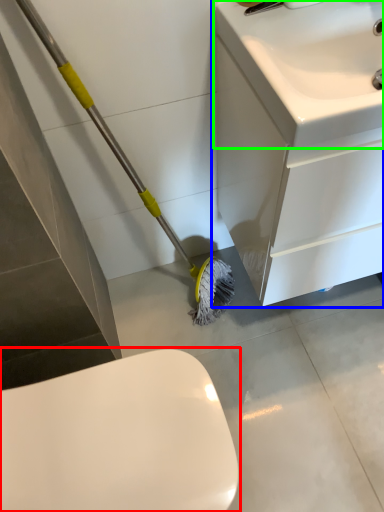
Question: Based on their relative distances, which object is farther from toilet (highlighted by a red box)? Choose from bathroom cabinet (highlighted by a blue box) and sink (highlighted by a green box).

Choices:
 (A) bathroom cabinet
 (B) sink

Answer: (B)